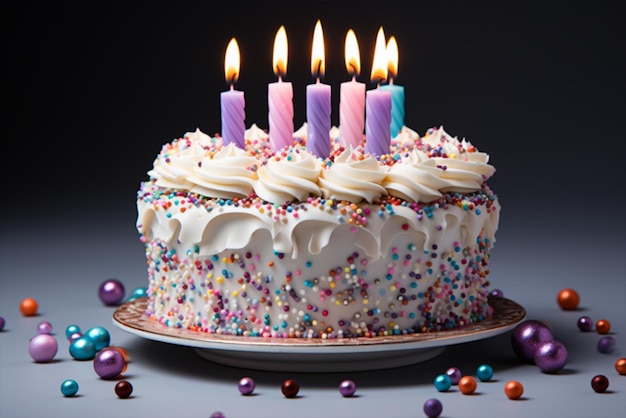
Where is `candle flames`? candle flames is located at coordinates (235, 60), (279, 48), (321, 49), (352, 49), (381, 64), (393, 63).